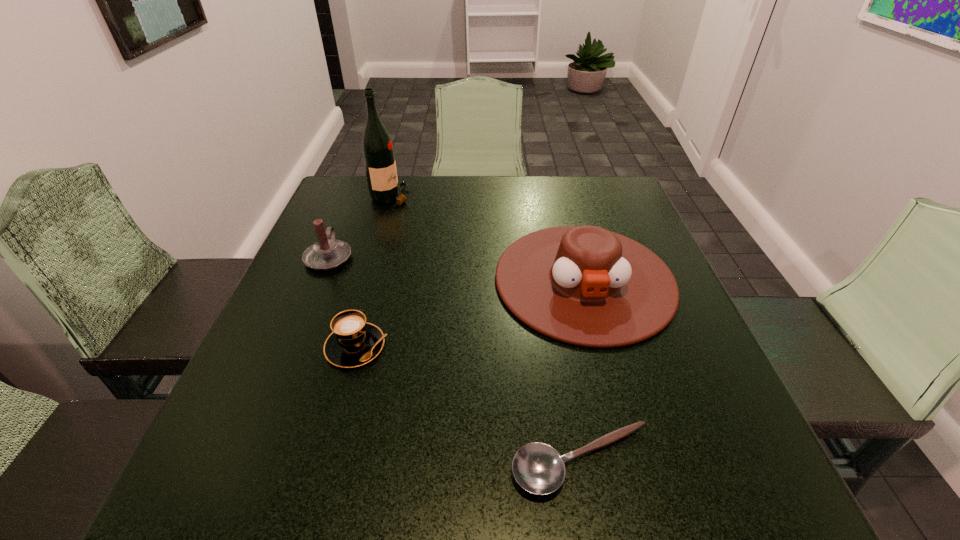
The image size is (960, 540). I want to click on ladle that is at the right edge, so click(538, 468).

Locate an element on the screen. Image resolution: width=960 pixels, height=540 pixels. object located in the far left corner section of the desktop is located at coordinates (377, 147).

Identify the location of object that is at the near right corner. Image resolution: width=960 pixels, height=540 pixels. (538, 468).

The height and width of the screenshot is (540, 960). I want to click on free space at the far edge of the desktop, so tap(450, 213).

At what (x,y) coordinates should I click in order to perform the action: click on blank space at the near edge. Please return your answer as a coordinate pair (x, y). Looking at the image, I should click on (658, 477).

What are the coordinates of `vacant space at the left edge of the desktop` in the screenshot? It's located at (268, 411).

In the image, there is a desktop. Where is `vacant space at the right edge`? Image resolution: width=960 pixels, height=540 pixels. vacant space at the right edge is located at coordinates (586, 221).

Where is `empty location between the cowboy hat and the ladle`? The height and width of the screenshot is (540, 960). empty location between the cowboy hat and the ladle is located at coordinates (584, 370).

The height and width of the screenshot is (540, 960). What are the coordinates of `vacant region between the wine bottle and the cowboy hat` in the screenshot? It's located at click(488, 238).

At what (x,y) coordinates should I click in order to perform the action: click on vacant area between the candle and the tallest object. Please return your answer as a coordinate pair (x, y). Looking at the image, I should click on (360, 226).